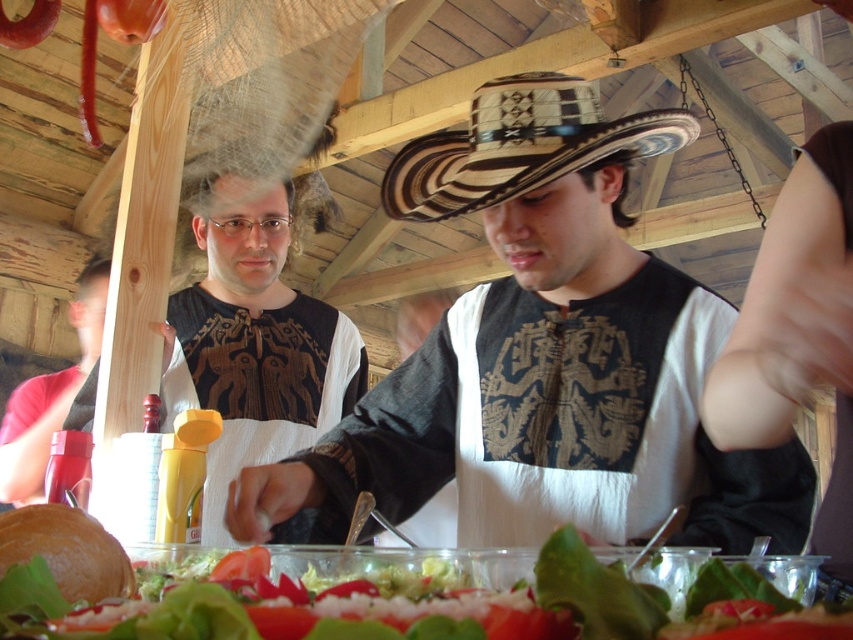
You are standing in front of the rustic wooden structure and looking at the table with fresh ingredients. Where is the matte black vest at center located in terms of its 2D coordinates?

The matte black vest at center is located at the 2D coordinates point (543, 356).

You are a customer at this rustic wooden structure and notice two items at the center of the scene. Which item is positioned higher between the matte black vest at center and the brown woven straw cowboy hat at center?

The brown woven straw cowboy hat at center is positioned higher than the matte black vest at center because the matte black vest at center is below it.

You are a customer at the rustic wooden food stall and notice two items at the center of the scene. Which item is closer to you between the matte black vest at center and the brown woven straw cowboy hat at center?

The matte black vest at center is closer to you because it is in front of the brown woven straw cowboy hat at center.